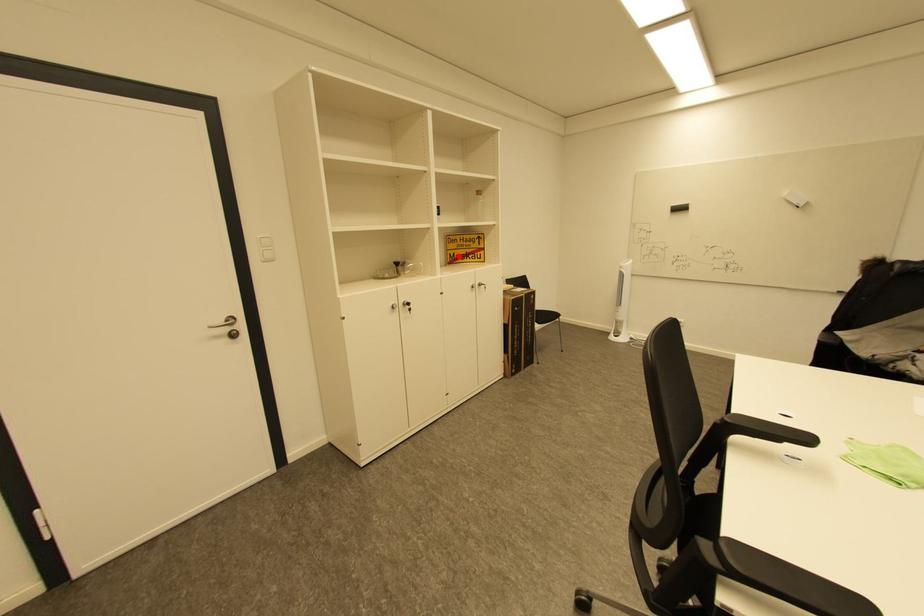
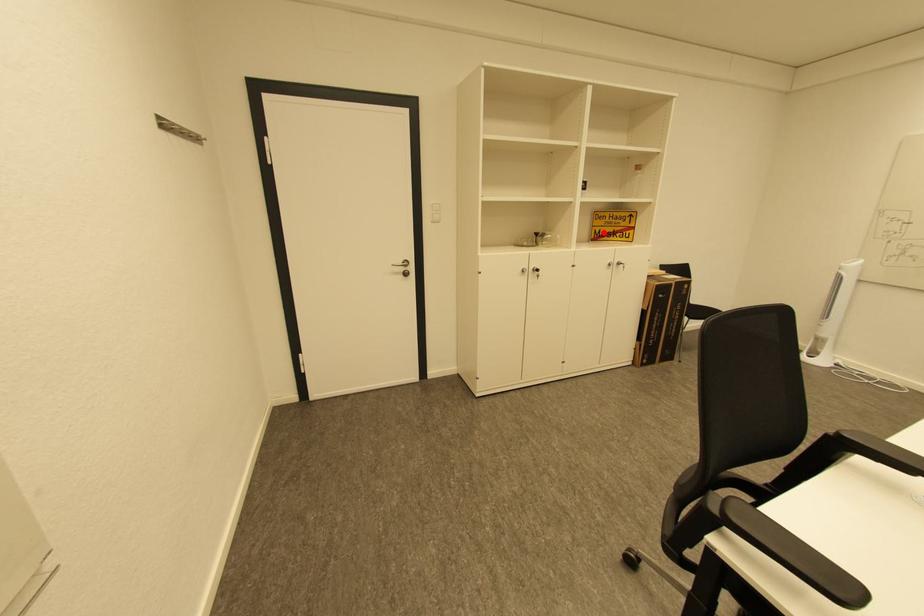
I am providing you with two images of the same scene from different viewpoints. A red point is marked on the first image and another point is marked on the second image. Do the highlighted points in image1 and image2 indicate the same real-world spot?

Yes